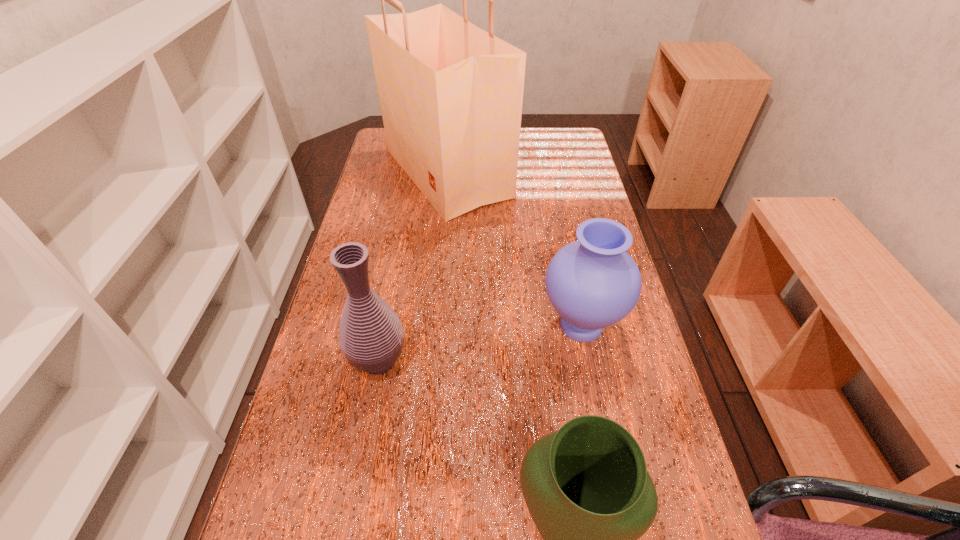
Image resolution: width=960 pixels, height=540 pixels. I want to click on the tallest object, so click(451, 94).

You are a GUI agent. You are given a task and a screenshot of the screen. Output one action in this format:
    pyautogui.click(x=<x>, y=<y>)
    Task: Click on the grocery bag
    The width and height of the screenshot is (960, 540).
    Given the screenshot: What is the action you would take?
    pyautogui.click(x=451, y=94)

The width and height of the screenshot is (960, 540). Identify the location of the leftmost vase. 371,336.

Where is `vacant space located 0.150m on the side of the tallest object with the superhero design`? vacant space located 0.150m on the side of the tallest object with the superhero design is located at coordinates (557, 173).

Identify the location of free point located on the back of the leftmost vase. 403,228.

What are the coordinates of `object situated at the far edge` in the screenshot? It's located at (451, 94).

Where is `grocery bag that is positioned at the left edge`? grocery bag that is positioned at the left edge is located at coordinates (451, 94).

Locate an element on the screen. The image size is (960, 540). vase situated at the left edge is located at coordinates (371, 336).

Find the location of `object present at the right edge`. object present at the right edge is located at coordinates (592, 283).

At what (x,y) coordinates should I click in order to perform the action: click on object present at the far left corner. Please return your answer as a coordinate pair (x, y). The image size is (960, 540). Looking at the image, I should click on (451, 94).